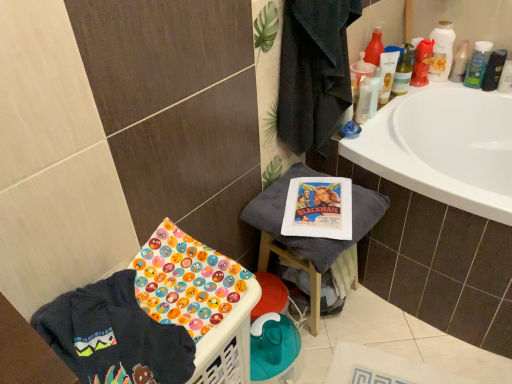
Where is `green plastic mouthwash at upper right, the 2th mouthwash viewed from the right`? green plastic mouthwash at upper right, the 2th mouthwash viewed from the right is located at coordinates (478, 64).

What is the approximate width of translucent plastic bottle at upper right?

2.00 inches.

The image size is (512, 384). Describe the element at coordinates (460, 62) in the screenshot. I see `translucent plastic bottle at upper right` at that location.

The width and height of the screenshot is (512, 384). What do you see at coordinates (114, 336) in the screenshot?
I see `dark blue cotton t-shirt at lower left` at bounding box center [114, 336].

I want to click on green plastic mouthwash at upper right, which is the 5th mouthwash from left to right, so click(x=478, y=64).

Who is shorter, translucent plastic bottle at upper right or white cotton towel at center?

With less height is translucent plastic bottle at upper right.

Is translucent plastic bottle at upper right thinner than white cotton towel at center?

Yes, translucent plastic bottle at upper right is thinner than white cotton towel at center.

Is translucent plastic bottle at upper right positioned before white cotton towel at center?

No, the depth of translucent plastic bottle at upper right is greater than that of white cotton towel at center.

Considering the relative sizes of translucent plastic mouthwash at upper right, positioned as the 3th mouthwash in left-to-right order, and green plastic mouthwash at upper right, the 2th mouthwash viewed from the right, in the image provided, is translucent plastic mouthwash at upper right, positioned as the 3th mouthwash in left-to-right order, shorter than green plastic mouthwash at upper right, the 2th mouthwash viewed from the right,?

No.

Is translucent plastic mouthwash at upper right, positioned as the 3th mouthwash in left-to-right order, at the right side of green plastic mouthwash at upper right, the 2th mouthwash viewed from the right?

No.

Is translucent plastic mouthwash at upper right, positioned as the fourth mouthwash in right-to-left order, touching green plastic mouthwash at upper right, which is the 5th mouthwash from left to right?

translucent plastic mouthwash at upper right, positioned as the fourth mouthwash in right-to-left order, and green plastic mouthwash at upper right, which is the 5th mouthwash from left to right, are not in contact.

Does point (398, 77) come behind point (474, 62)?

That is False.

Is point (73, 315) closer to camera compared to point (360, 94)?

Yes, it is in front of point (360, 94).

Would you say dark blue cotton t-shirt at lower left is to the left or to the right of white plastic mouthwash at upper right, the sixth mouthwash from the right, in the picture?

dark blue cotton t-shirt at lower left is to the left of white plastic mouthwash at upper right, the sixth mouthwash from the right.

From the picture: What's the angular difference between dark blue cotton t-shirt at lower left and white plastic mouthwash at upper right, the sixth mouthwash from the right,'s facing directions?

3.11e-05 degrees.

How far apart are dark blue cotton t-shirt at lower left and white plastic mouthwash at upper right, marked as the 1th mouthwash in a left-to-right arrangement?

dark blue cotton t-shirt at lower left is 1.12 meters from white plastic mouthwash at upper right, marked as the 1th mouthwash in a left-to-right arrangement.

Looking at this image, considering the positions of objects white plastic mouthwash at upper right, the sixth mouthwash from the right, and translucent plastic mouthwash at upper right, the fifth mouthwash positioned from the right, in the image provided, who is behind, white plastic mouthwash at upper right, the sixth mouthwash from the right, or translucent plastic mouthwash at upper right, the fifth mouthwash positioned from the right,?

translucent plastic mouthwash at upper right, the fifth mouthwash positioned from the right, is behind.

Does point (355, 117) come in front of point (394, 55)?

Yes, point (355, 117) is in front of point (394, 55).

From the image's perspective, which is above, white plastic mouthwash at upper right, marked as the 1th mouthwash in a left-to-right arrangement, or translucent plastic mouthwash at upper right, the fifth mouthwash positioned from the right?

translucent plastic mouthwash at upper right, the fifth mouthwash positioned from the right.

From a real-world perspective, is white plastic mouthwash at upper right, the sixth mouthwash from the right, on top of translucent plastic mouthwash at upper right, the second mouthwash when ordered from left to right?

No, from a real-world perspective, white plastic mouthwash at upper right, the sixth mouthwash from the right, is not on top of translucent plastic mouthwash at upper right, the second mouthwash when ordered from left to right.

Is the depth of translucent plastic mouthwash at upper right, acting as the 4th mouthwash starting from the left, less than that of translucent plastic mouthwash at upper right, the fifth mouthwash positioned from the right?

No, translucent plastic mouthwash at upper right, acting as the 4th mouthwash starting from the left, is further to the viewer.

Would you consider translucent plastic mouthwash at upper right, acting as the 4th mouthwash starting from the left, to be distant from translucent plastic mouthwash at upper right, the fifth mouthwash positioned from the right?

translucent plastic mouthwash at upper right, acting as the 4th mouthwash starting from the left, is actually quite close to translucent plastic mouthwash at upper right, the fifth mouthwash positioned from the right.

Is translucent plastic mouthwash at upper right, arranged as the third mouthwash when viewed from the right, oriented towards translucent plastic mouthwash at upper right, the second mouthwash when ordered from left to right?

No, translucent plastic mouthwash at upper right, arranged as the third mouthwash when viewed from the right, is not oriented towards translucent plastic mouthwash at upper right, the second mouthwash when ordered from left to right.

I want to click on cleaning product on the right side of translucent plastic mouthwash at upper right, arranged as the third mouthwash when viewed from the right, so click(460, 62).

From the picture: Is translucent plastic mouthwash at upper right, acting as the 4th mouthwash starting from the left, touching translucent plastic bottle at upper right?

No, translucent plastic mouthwash at upper right, acting as the 4th mouthwash starting from the left, is not beside translucent plastic bottle at upper right.

From a real-world perspective, which is physically above, translucent plastic mouthwash at upper right, arranged as the third mouthwash when viewed from the right, or translucent plastic bottle at upper right?

translucent plastic mouthwash at upper right, arranged as the third mouthwash when viewed from the right, is physically above.

From a real-world perspective, between dark blue cotton t-shirt at lower left and translucent plastic mouthwash at upper right, the second mouthwash when ordered from left to right, who is vertically lower?

dark blue cotton t-shirt at lower left is physically lower.

The width and height of the screenshot is (512, 384). Identify the location of clothing below the translucent plastic mouthwash at upper right, the fifth mouthwash positioned from the right (from a real-world perspective). (114, 336).

From the image's perspective, which is above, dark blue cotton t-shirt at lower left or translucent plastic mouthwash at upper right, the fifth mouthwash positioned from the right?

From the image's view, translucent plastic mouthwash at upper right, the fifth mouthwash positioned from the right, is above.

Does dark blue cotton t-shirt at lower left have a larger size compared to translucent plastic mouthwash at upper right, the second mouthwash when ordered from left to right?

Yes.

Find the location of a particular element. beach towel below the translucent plastic bottle at upper right (from the image's perspective) is located at coordinates (312, 237).

From a real-world perspective, starting from the green plastic mouthwash at upper right, the 2th mouthwash viewed from the right, which mouthwash is the 2nd one vertically above it? Please provide its 2D coordinates.

[(404, 71)]

Considering their positions, is translucent plastic mouthwash at upper right, positioned as the 3th mouthwash in left-to-right order, positioned closer to translucent plastic mouthwash at upper right, arranged as the third mouthwash when viewed from the right, than black matte bottle at upper right, placed as the 1th mouthwash when sorted from right to left?

translucent plastic mouthwash at upper right, positioned as the 3th mouthwash in left-to-right order, is positioned closer to the anchor translucent plastic mouthwash at upper right, arranged as the third mouthwash when viewed from the right.

Looking at this image, looking at the image, which one is located further to white plastic mouthwash at upper right, the sixth mouthwash from the right, translucent plastic mouthwash at upper right, the fifth mouthwash positioned from the right, or white cotton towel at center?

white cotton towel at center is positioned further to the anchor white plastic mouthwash at upper right, the sixth mouthwash from the right.

Considering their positions, is translucent plastic mouthwash at upper right, acting as the 4th mouthwash starting from the left, positioned closer to translucent plastic mouthwash at upper right, the fifth mouthwash positioned from the right, than black matte bottle at upper right, placed as the 1th mouthwash when sorted from right to left?

Among the two, translucent plastic mouthwash at upper right, acting as the 4th mouthwash starting from the left, is located nearer to translucent plastic mouthwash at upper right, the fifth mouthwash positioned from the right.

Which object lies nearer to the anchor point dark blue cotton t-shirt at lower left, translucent plastic bottle at upper right or black matte bottle at upper right, placed as the 1th mouthwash when sorted from right to left?

translucent plastic bottle at upper right.

From the image, which object appears to be nearer to dark blue cotton t-shirt at lower left, translucent plastic mouthwash at upper right, arranged as the third mouthwash when viewed from the right, or white cotton towel at center?

white cotton towel at center lies closer to dark blue cotton t-shirt at lower left than the other object.

Considering their positions, is white cotton towel at center positioned closer to black matte bottle at upper right, the 6th mouthwash viewed from the left, than green plastic mouthwash at upper right, which is the 5th mouthwash from left to right?

green plastic mouthwash at upper right, which is the 5th mouthwash from left to right, is closer to black matte bottle at upper right, the 6th mouthwash viewed from the left.

Based on their spatial positions, is dark blue cotton t-shirt at lower left or white cotton towel at center further from black matte bottle at upper right, the 6th mouthwash viewed from the left?

Among the two, dark blue cotton t-shirt at lower left is located further to black matte bottle at upper right, the 6th mouthwash viewed from the left.

Looking at the image, which one is located closer to translucent plastic mouthwash at upper right, positioned as the fourth mouthwash in right-to-left order, translucent plastic bottle at upper right or translucent plastic mouthwash at upper right, the fifth mouthwash positioned from the right?

translucent plastic mouthwash at upper right, the fifth mouthwash positioned from the right.

The image size is (512, 384). I want to click on mouthwash between translucent plastic mouthwash at upper right, the second mouthwash when ordered from left to right, and translucent plastic mouthwash at upper right, arranged as the third mouthwash when viewed from the right, in the horizontal direction, so click(x=404, y=71).

Locate an element on the screen. This screenshot has width=512, height=384. mouthwash situated between white plastic mouthwash at upper right, the sixth mouthwash from the right, and translucent plastic mouthwash at upper right, positioned as the fourth mouthwash in right-to-left order, from left to right is located at coordinates (387, 74).

You are a GUI agent. You are given a task and a screenshot of the screen. Output one action in this format:
    pyautogui.click(x=<x>, y=<y>)
    Task: Click on the beach towel located between dark blue cotton t-shirt at lower left and translucent plastic mouthwash at upper right, the second mouthwash when ordered from left to right, in the depth direction
    The height and width of the screenshot is (384, 512).
    Given the screenshot: What is the action you would take?
    pyautogui.click(x=312, y=237)

The width and height of the screenshot is (512, 384). In order to click on beach towel located between dark blue cotton t-shirt at lower left and black matte bottle at upper right, the 6th mouthwash viewed from the left, in the left-right direction in this screenshot , I will do `click(312, 237)`.